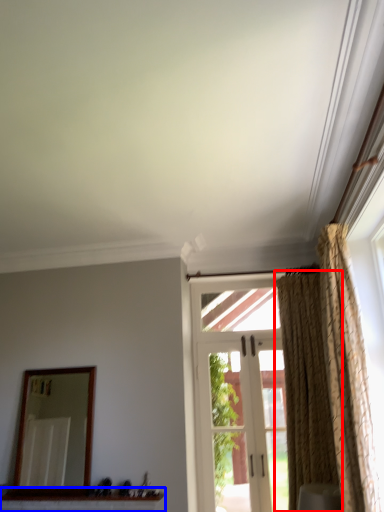
Question: Which object is closer to the camera taking this photo, curtain (highlighted by a red box) or window sill (highlighted by a blue box)?

Choices:
 (A) curtain
 (B) window sill

Answer: (A)